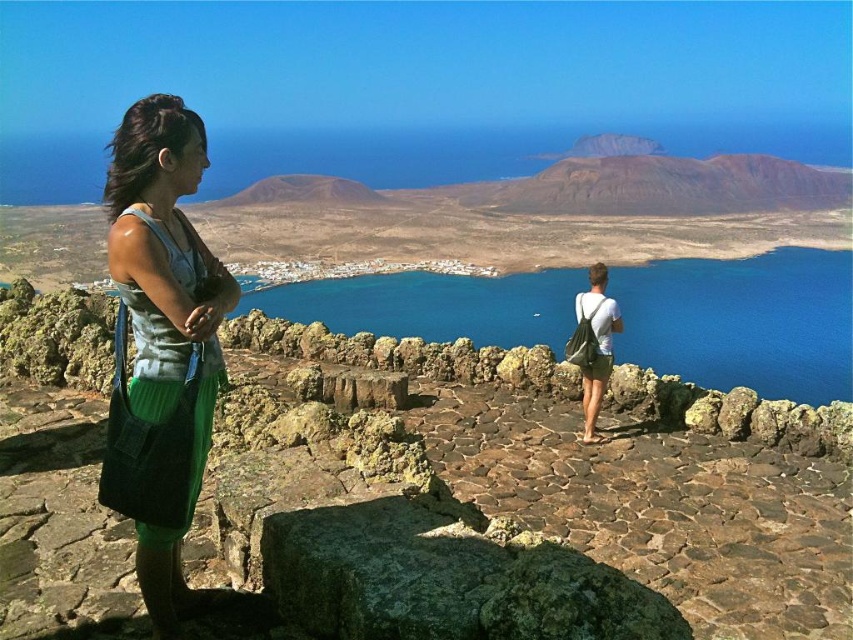
Which is behind, point (573, 620) or point (173, 218)?

Positioned behind is point (173, 218).

Does rusty stone wall at center come behind green corduroy skirt at left?

No, it is not.

Between point (498, 512) and point (170, 330), which one is positioned in front?

Positioned in front is point (170, 330).

Locate an element on the screen. rusty stone wall at center is located at coordinates (538, 545).

Is rusty stone wall at center taller than green canvas backpack at right?

Yes.

Is point (463, 404) closer to viewer compared to point (604, 381)?

No, (463, 404) is behind (604, 381).

Is point (637, 632) closer to camera compared to point (598, 355)?

Yes.

Identify the location of rusty stone wall at center. The width and height of the screenshot is (853, 640). (538, 545).

Can you confirm if blue water at center is positioned to the right of green canvas backpack at right?

Correct, you'll find blue water at center to the right of green canvas backpack at right.

Who is higher up, blue water at center or green canvas backpack at right?

blue water at center is above.

Locate an element on the screen. The height and width of the screenshot is (640, 853). blue water at center is located at coordinates (743, 321).